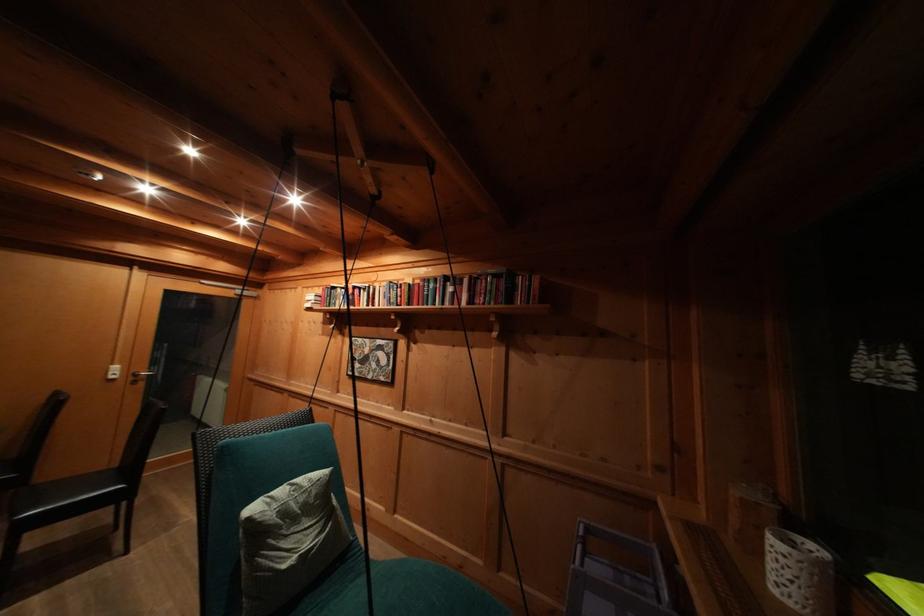
The image size is (924, 616). In order to click on chair sitting surface in this screenshot , I will do `click(64, 492)`.